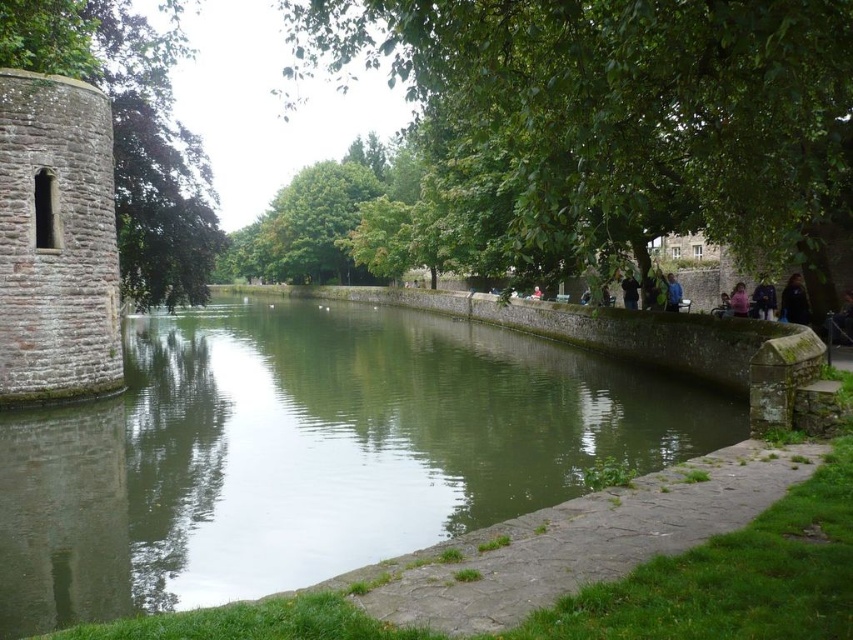
Does green leafy tree at center lie in front of dark blue fabric at right?

Yes, it is in front of dark blue fabric at right.

Who is positioned more to the left, green leafy tree at center or dark blue fabric at right?

green leafy tree at center

Locate an element on the screen. This screenshot has width=853, height=640. green leafy tree at center is located at coordinates (621, 116).

This screenshot has width=853, height=640. Find the location of `green leafy tree at center`. green leafy tree at center is located at coordinates point(621,116).

Between green leafy tree at center and dark brown hair at right, which one appears on the right side from the viewer's perspective?

dark brown hair at right

Does point (747, 116) come in front of point (802, 292)?

Yes, it is in front of point (802, 292).

Image resolution: width=853 pixels, height=640 pixels. I want to click on green leafy tree at center, so click(x=621, y=116).

Image resolution: width=853 pixels, height=640 pixels. What are the coordinates of `green leafy tree at center` in the screenshot? It's located at click(x=621, y=116).

Is point (33, 227) positioned after point (793, 285)?

No, it is in front of (793, 285).

The image size is (853, 640). What are the coordinates of `brick stone tower at left` in the screenshot? It's located at (56, 241).